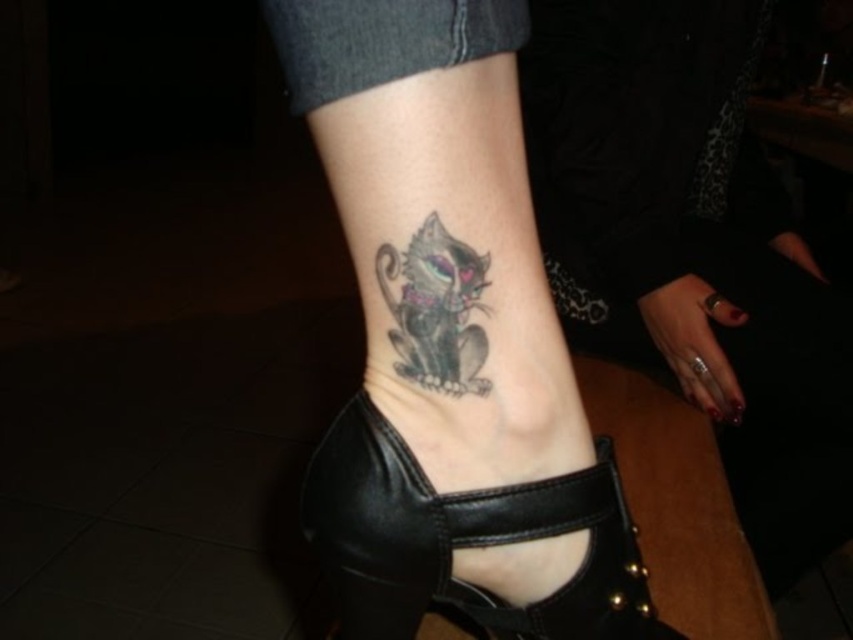
Question: Among these objects, which one is farthest from the camera?

Choices:
 (A) black leather sandal at lower center
 (B) shiny black cat at lower center

Answer: (A)

Question: Observing the image, what is the correct spatial positioning of black leather sandal at lower center in reference to shiny black cat at lower center?

Choices:
 (A) right
 (B) left

Answer: (A)

Question: Does black leather sandal at lower center have a lesser width compared to shiny black cat at lower center?

Choices:
 (A) yes
 (B) no

Answer: (B)

Question: Is black leather sandal at lower center closer to camera compared to shiny black cat at lower center?

Choices:
 (A) yes
 (B) no

Answer: (B)

Question: Which of the following is the farthest from the observer?

Choices:
 (A) (428, 332)
 (B) (596, 556)

Answer: (B)